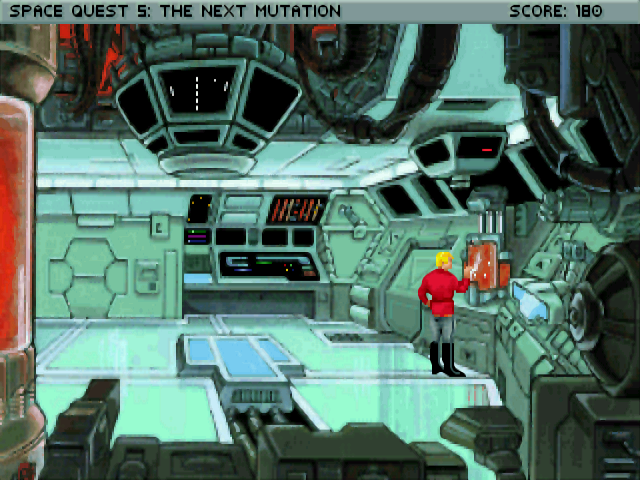
Find the location of a particular element. glass is located at coordinates (237, 359).